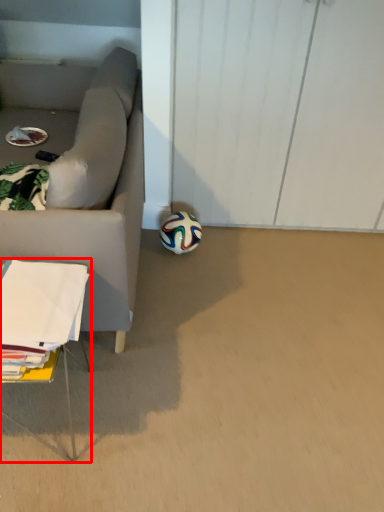
Question: From the image's perspective, where is table (annotated by the red box) located relative to football?

Choices:
 (A) below
 (B) above

Answer: (A)